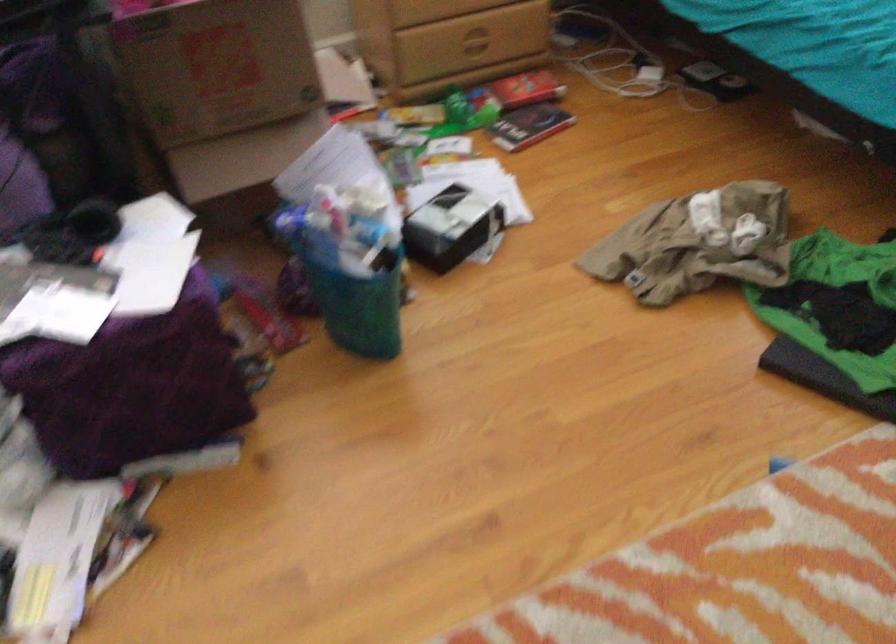
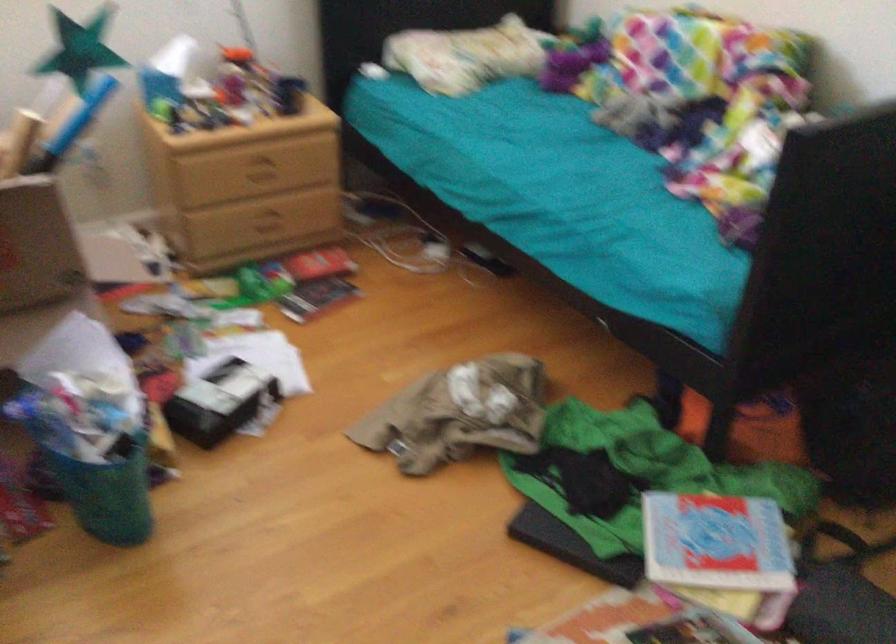
Where in the second image is the point corresponding to (273,70) from the first image?

(36, 245)